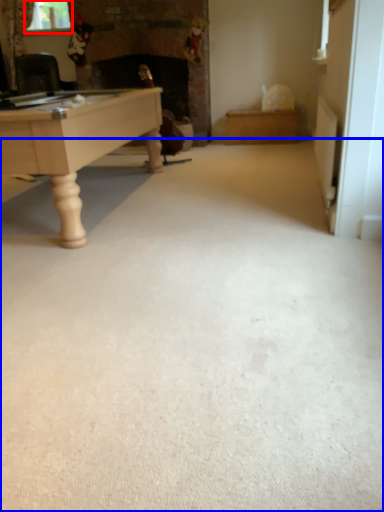
Question: Which point is closer to the camera, window screen (highlighted by a red box) or plain (highlighted by a blue box)?

Choices:
 (A) window screen
 (B) plain

Answer: (B)